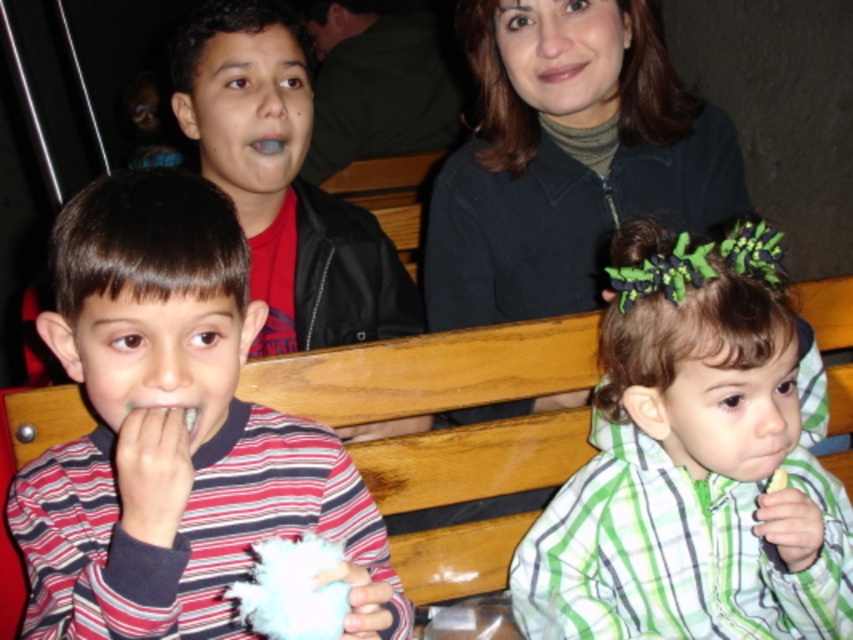
Question: Which object is farther from the camera taking this photo?

Choices:
 (A) dark green turtleneck at upper center
 (B) striped cotton shirt at left

Answer: (A)

Question: Which object is positioned farthest from the striped cotton shirt at left?

Choices:
 (A) green plaid shirt at right
 (B) dark green turtleneck at upper center

Answer: (B)

Question: Is green plaid shirt at right above dark green turtleneck at upper center?

Choices:
 (A) yes
 (B) no

Answer: (B)

Question: Does striped cotton shirt at left have a smaller size compared to dark green turtleneck at upper center?

Choices:
 (A) no
 (B) yes

Answer: (B)

Question: Is green plaid shirt at right smaller than dark green turtleneck at upper center?

Choices:
 (A) no
 (B) yes

Answer: (B)

Question: Among these objects, which one is farthest from the camera?

Choices:
 (A) striped cotton shirt at left
 (B) green plaid shirt at right
 (C) dark green turtleneck at upper center

Answer: (C)